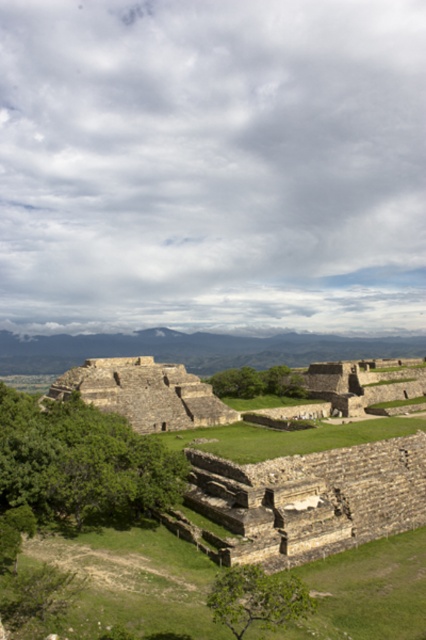
Does stone ruins at center lie behind brown stone pyramid at center?

Yes, stone ruins at center is further from the viewer.

What do you see at coordinates (195, 349) in the screenshot? The width and height of the screenshot is (426, 640). I see `stone ruins at center` at bounding box center [195, 349].

Is point (91, 355) closer to camera compared to point (131, 397)?

No.

Image resolution: width=426 pixels, height=640 pixels. What are the coordinates of `stone ruins at center` in the screenshot? It's located at (195, 349).

Is stone ruins at center bigger than green grassy at center?

Yes.

Who is shorter, stone ruins at center or green grassy at center?

Standing shorter between the two is green grassy at center.

This screenshot has height=640, width=426. What do you see at coordinates (195, 349) in the screenshot? I see `stone ruins at center` at bounding box center [195, 349].

The height and width of the screenshot is (640, 426). I want to click on stone ruins at center, so click(x=195, y=349).

Does stone wall at center have a lesser height compared to green grassy at center?

No.

Where is `stone wall at center`? stone wall at center is located at coordinates (302, 500).

This screenshot has height=640, width=426. I want to click on stone wall at center, so click(x=302, y=500).